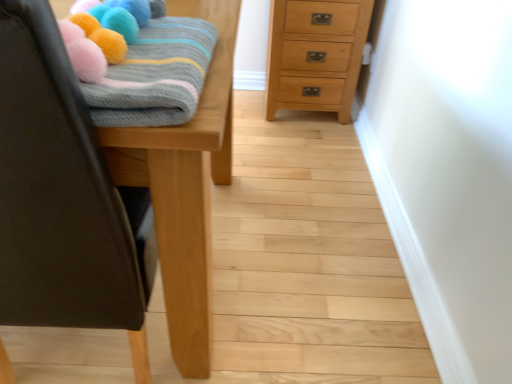
Find the location of a particular element. Image resolution: width=512 pixels, height=384 pixels. vacant space in front of natural wood chest of drawers at upper right is located at coordinates (302, 148).